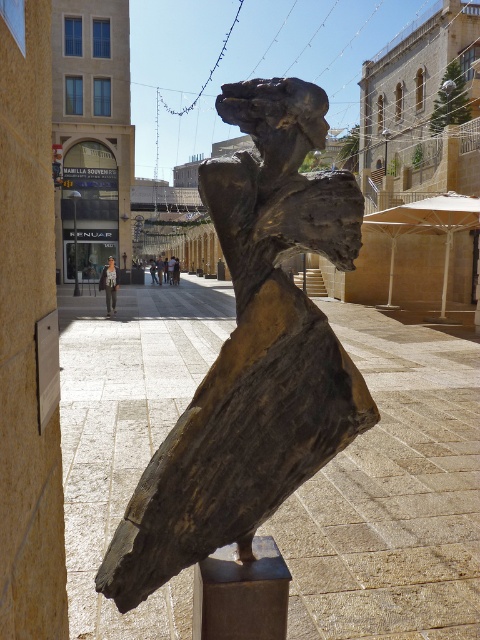
In order to click on bronze statue at center in this screenshot , I will do `click(252, 353)`.

Is point (223, 524) closer to camera compared to point (117, 282)?

That is True.

Which is behind, point (278, 444) or point (100, 285)?

Positioned behind is point (100, 285).

Where is `bronze statue at center`? The image size is (480, 640). bronze statue at center is located at coordinates (252, 353).